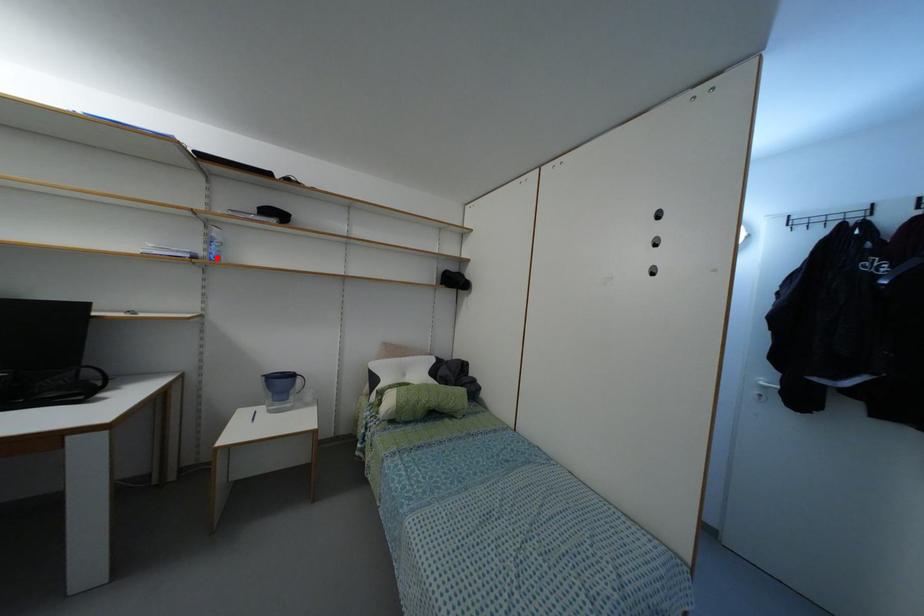
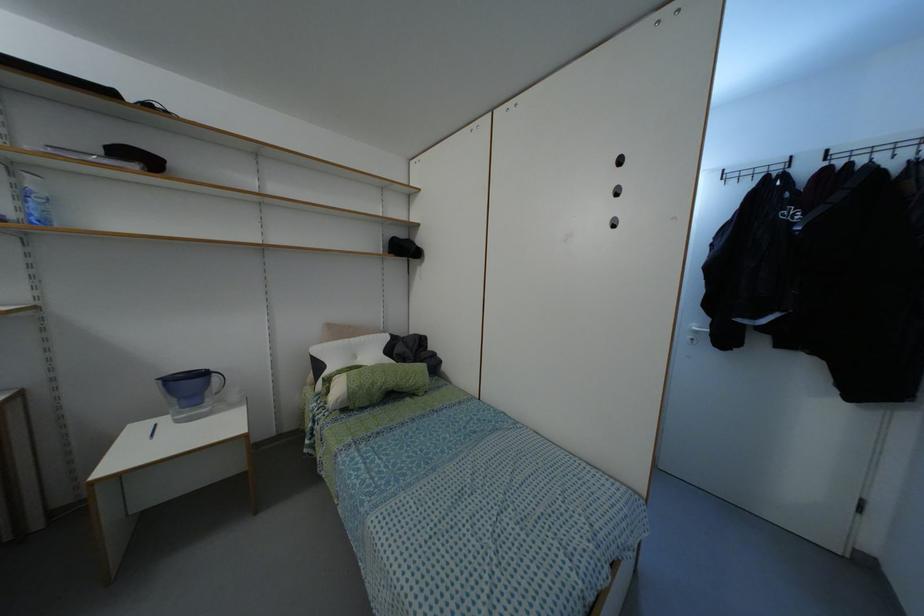
In the second image, find the point that corresponds to the highlighted location in the first image.

(44, 222)